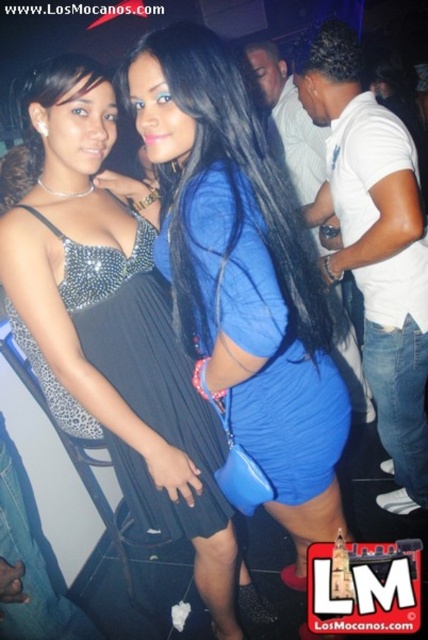
You are at a party and want to take a photo of both the point at coordinates point (321, 493) and the point at coordinates point (255, 211). Which point should you focus on first to ensure both are in the frame?

Point (255, 211) should be focused on first because it is in front of point (321, 493), so focusing there will keep both in the frame.

You are a photographer at a party and need to adjust the lighting so that the blue matte dress at center and the black satin dress at left are both well lit. Given their height difference, which dress requires a higher light source to ensure proper illumination?

The blue matte dress at center is much taller than the black satin dress at left, so the blue matte dress at center requires a higher light source to ensure proper illumination.